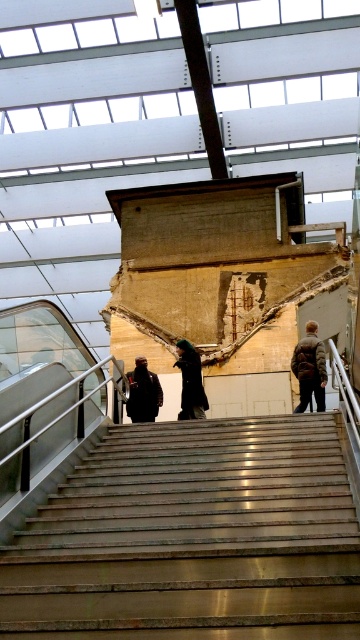
Question: Can you confirm if polished marble stairs at center is positioned below dark gray jacket at center?

Choices:
 (A) no
 (B) yes

Answer: (B)

Question: Which point appears farthest from the camera in this image?

Choices:
 (A) (190, 372)
 (B) (309, 388)
 (C) (54, 620)
 (D) (162, 397)

Answer: (D)

Question: Can you confirm if polished marble stairs at center is positioned to the right of black matte coat at center?

Choices:
 (A) no
 (B) yes

Answer: (A)

Question: Which is farther from the black matte coat at center?

Choices:
 (A) brown fuzzy coat at upper right
 (B) dark gray jacket at center

Answer: (A)

Question: Is black matte coat at center positioned behind dark gray jacket at center?

Choices:
 (A) yes
 (B) no

Answer: (A)

Question: Among these objects, which one is nearest to the camera?

Choices:
 (A) black matte coat at center
 (B) polished marble stairs at center

Answer: (B)